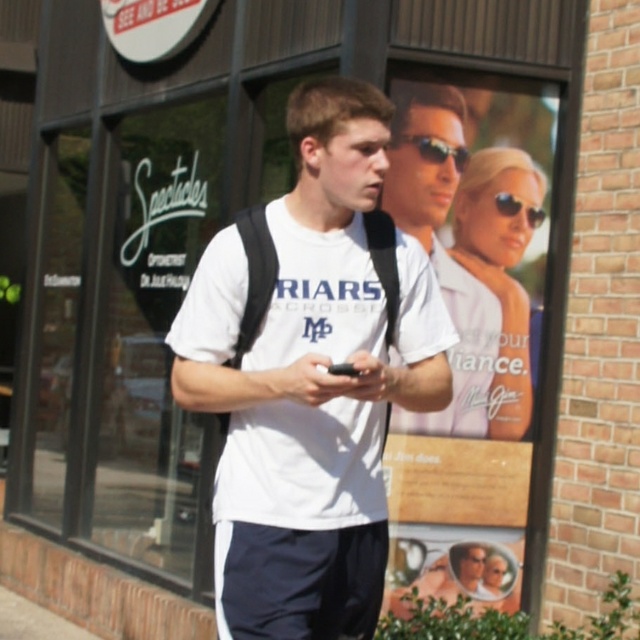
What are the coordinates of the matte white shirt at center in the image?

The coordinates of the matte white shirt at center are at point (442, 248).